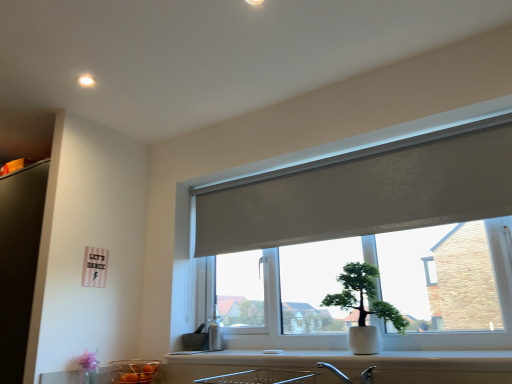
Question: Is white glossy counter top at lower center outside white ceramic pot at center?

Choices:
 (A) yes
 (B) no

Answer: (A)

Question: Does white glossy counter top at lower center have a larger size compared to white ceramic pot at center?

Choices:
 (A) yes
 (B) no

Answer: (B)

Question: Is white glossy counter top at lower center taller than white ceramic pot at center?

Choices:
 (A) yes
 (B) no

Answer: (B)

Question: Is white glossy counter top at lower center at the left side of white ceramic pot at center?

Choices:
 (A) no
 (B) yes

Answer: (B)

Question: From the image's perspective, is white glossy counter top at lower center under white ceramic pot at center?

Choices:
 (A) no
 (B) yes

Answer: (B)

Question: Considering the positions of point (331, 201) and point (158, 364), is point (331, 201) closer or farther from the camera than point (158, 364)?

Choices:
 (A) farther
 (B) closer

Answer: (B)

Question: From a real-world perspective, relative to translucent glass bowl at lower left, is matte gray roller blind at center vertically above or below?

Choices:
 (A) above
 (B) below

Answer: (A)

Question: Is matte gray roller blind at center wider or thinner than translucent glass bowl at lower left?

Choices:
 (A) wide
 (B) thin

Answer: (A)

Question: Considering the relative positions of matte gray roller blind at center and translucent glass bowl at lower left in the image provided, is matte gray roller blind at center to the left or to the right of translucent glass bowl at lower left?

Choices:
 (A) left
 (B) right

Answer: (B)

Question: Is point (298, 173) positioned closer to the camera than point (368, 309)?

Choices:
 (A) closer
 (B) farther

Answer: (B)

Question: Is matte gray roller blind at center bigger or smaller than white ceramic pot at center?

Choices:
 (A) big
 (B) small

Answer: (A)

Question: Considering the positions of matte gray roller blind at center and white ceramic pot at center in the image, is matte gray roller blind at center wider or thinner than white ceramic pot at center?

Choices:
 (A) thin
 (B) wide

Answer: (A)

Question: From a real-world perspective, relative to white ceramic pot at center, is matte gray roller blind at center vertically above or below?

Choices:
 (A) below
 (B) above

Answer: (B)

Question: Relative to matte gray roller blind at center, is white ceramic pot at center in front or behind?

Choices:
 (A) behind
 (B) front

Answer: (A)

Question: Looking at the image, does white ceramic pot at center seem bigger or smaller compared to matte gray roller blind at center?

Choices:
 (A) big
 (B) small

Answer: (B)